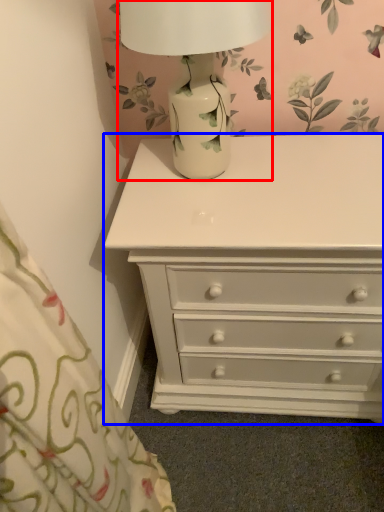
Question: Which point is further to the camera, table lamp (highlighted by a red box) or chest of drawers (highlighted by a blue box)?

Choices:
 (A) table lamp
 (B) chest of drawers

Answer: (B)